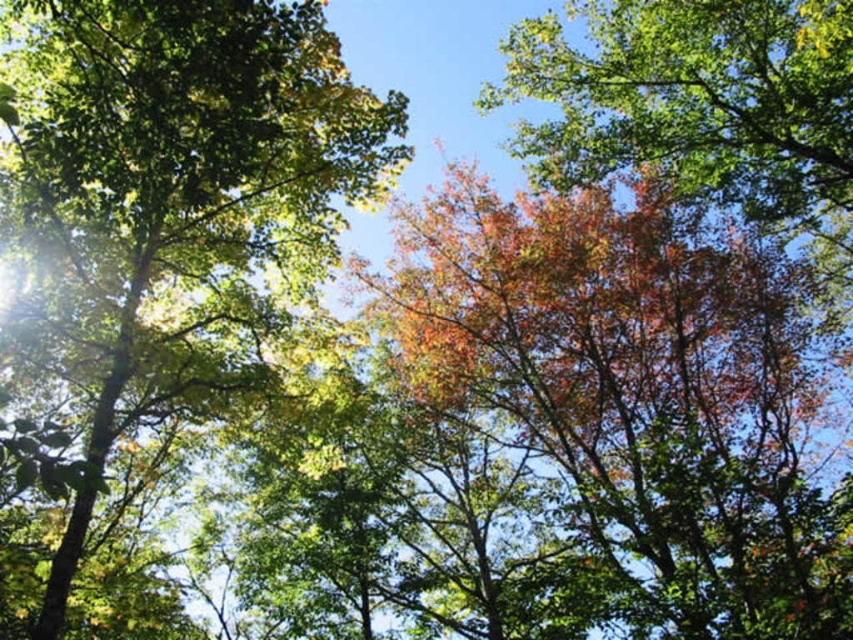
Is autumn leaves at center taller than green leafy tree at upper left?

No.

Is autumn leaves at center thinner than green leafy tree at upper left?

Correct, autumn leaves at center's width is less than green leafy tree at upper left's.

Is point (637, 237) farther from viewer compared to point (299, 61)?

Yes.

Identify the location of autumn leaves at center. (634, 394).

Is autumn leaves at center below multicolored foliage at upper right?

Yes, autumn leaves at center is below multicolored foliage at upper right.

Between point (763, 516) and point (827, 134), which one is positioned in front?

Positioned in front is point (827, 134).

Locate an element on the screen. The width and height of the screenshot is (853, 640). autumn leaves at center is located at coordinates (634, 394).

Who is shorter, green leafy tree at upper left or multicolored foliage at upper right?

With less height is green leafy tree at upper left.

Where is `green leafy tree at upper left`? The width and height of the screenshot is (853, 640). green leafy tree at upper left is located at coordinates (183, 182).